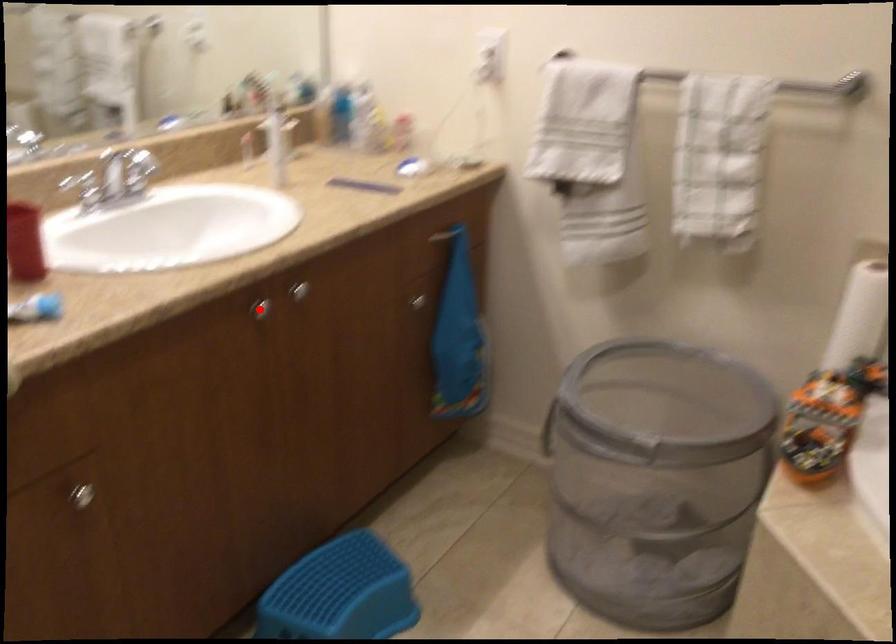
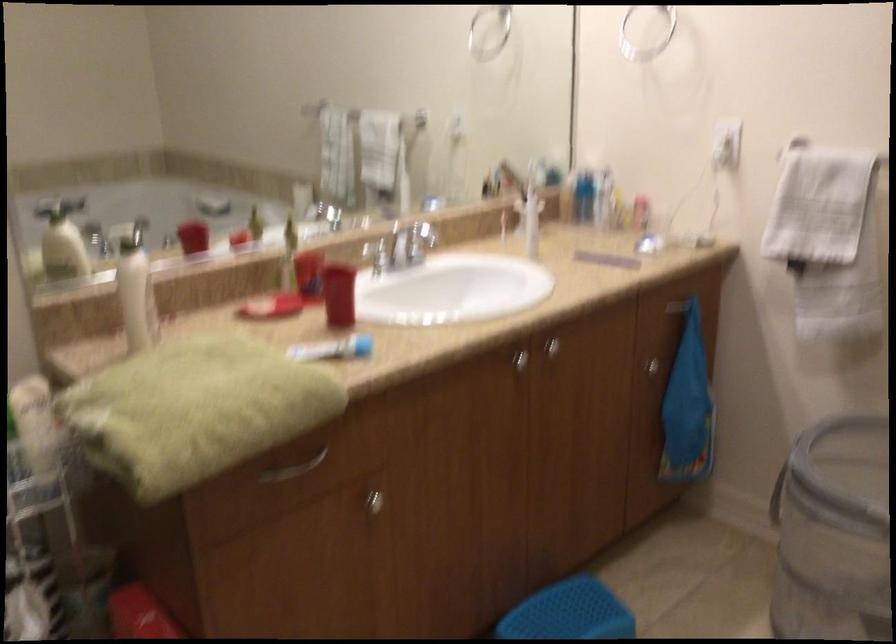
In the second image, find the point that corresponds to the highlighted location in the first image.

(519, 360)